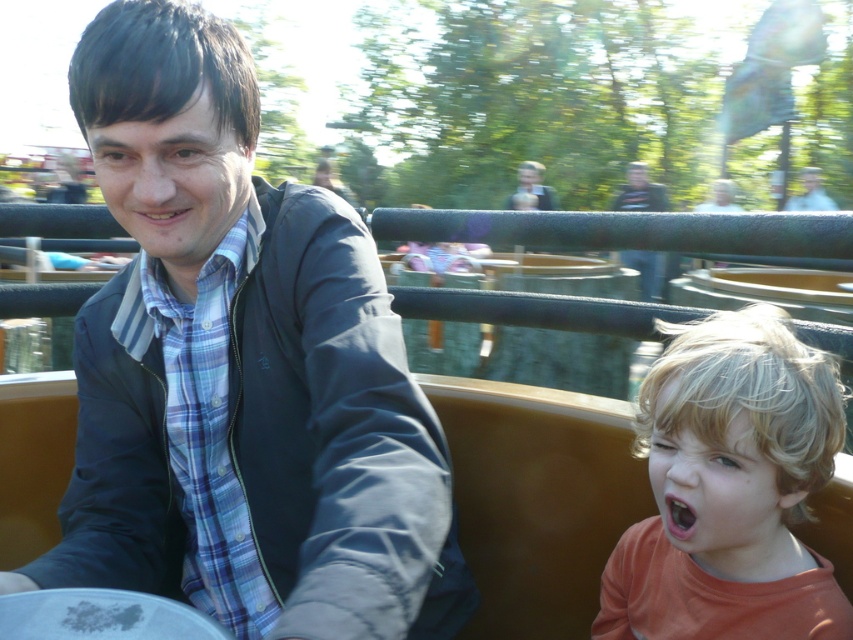
You are a photographer trying to capture a photo of the orange matte mouth at lower right and the matte black jacket at upper center. Based on their positions, which object should you focus on first if you want to ensure both are in the frame?

The orange matte mouth at lower right is to the left of the matte black jacket at upper center, so you should focus on the matte black jacket at upper center first to ensure both are in the frame.

You are a photographer trying to capture a candid shot of the blue plaid shirt at center and the matte blue shirt at upper center. If you want to ensure both shirts are fully visible in the frame, which shirt should you focus on first?

The blue plaid shirt at center has a smaller width than the matte blue shirt at upper center, so you should focus on the matte blue shirt at upper center first to ensure it fits properly in the frame.

You are a photographer trying to capture a photo of the orange matte mouth at lower right and the matte blue shirt at upper center in the scene. Based on their sizes in the image, which object should you focus on first if you want to ensure both are in frame without cropping?

The orange matte mouth at lower right is not as tall as the matte blue shirt at upper center, so you should focus on the matte blue shirt at upper center first to ensure it fits within the frame since it is larger.